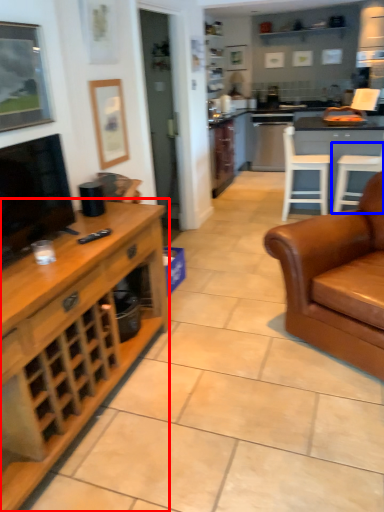
Question: Which point is further to the camera, cabinetry (highlighted by a red box) or chair (highlighted by a blue box)?

Choices:
 (A) cabinetry
 (B) chair

Answer: (B)